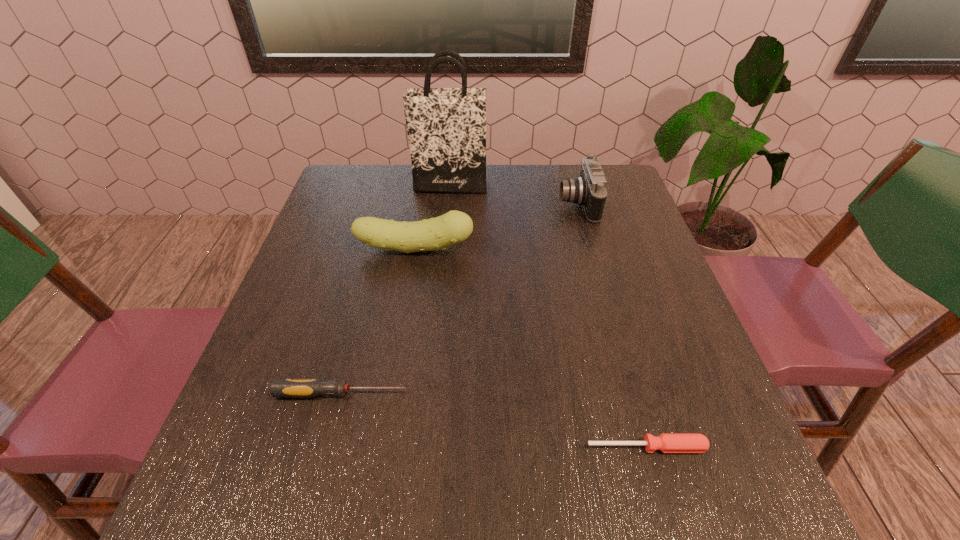
Image resolution: width=960 pixels, height=540 pixels. What are the coordinates of `vacant region between the third nearest object and the shopping bag` in the screenshot? It's located at (432, 218).

Locate an element on the screen. empty space that is in between the taller screwdriver and the cucumber is located at coordinates (378, 321).

Where is `unoccupied position between the farther screwdriver and the third nearest object`? The height and width of the screenshot is (540, 960). unoccupied position between the farther screwdriver and the third nearest object is located at coordinates (378, 321).

This screenshot has height=540, width=960. Identify the location of free space between the shopping bag and the right screwdriver. (548, 316).

You are a GUI agent. You are given a task and a screenshot of the screen. Output one action in this format:
    pyautogui.click(x=<x>, y=<y>)
    Task: Click on the free spot between the camera and the fourth tallest object
    The width and height of the screenshot is (960, 540).
    Given the screenshot: What is the action you would take?
    pyautogui.click(x=460, y=299)

Where is `vacant area that lies between the fourth farthest object and the tallest object`? vacant area that lies between the fourth farthest object and the tallest object is located at coordinates (396, 289).

Identify the location of empty location between the farther screwdriver and the tallest object. Image resolution: width=960 pixels, height=540 pixels. (396, 289).

Image resolution: width=960 pixels, height=540 pixels. What are the coordinates of `vacant space in between the shopping bag and the cucumber` in the screenshot? It's located at (432, 218).

Locate an element on the screen. object that is the third nearest to the farther screwdriver is located at coordinates (589, 190).

Locate which object ranks third in proximity to the tallest object. Please provide its 2D coordinates. Your answer should be formatted as a tuple, i.e. [(x, y)], where the tuple contains the x and y coordinates of a point satisfying the conditions above.

[(280, 388)]